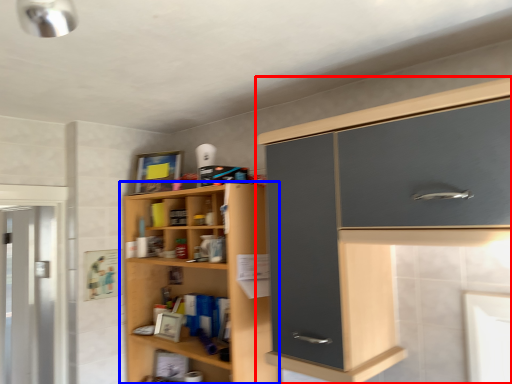
Question: Among these objects, which one is nearest to the camera, cabinetry (highlighted by a red box) or cupboard (highlighted by a blue box)?

Choices:
 (A) cabinetry
 (B) cupboard

Answer: (A)